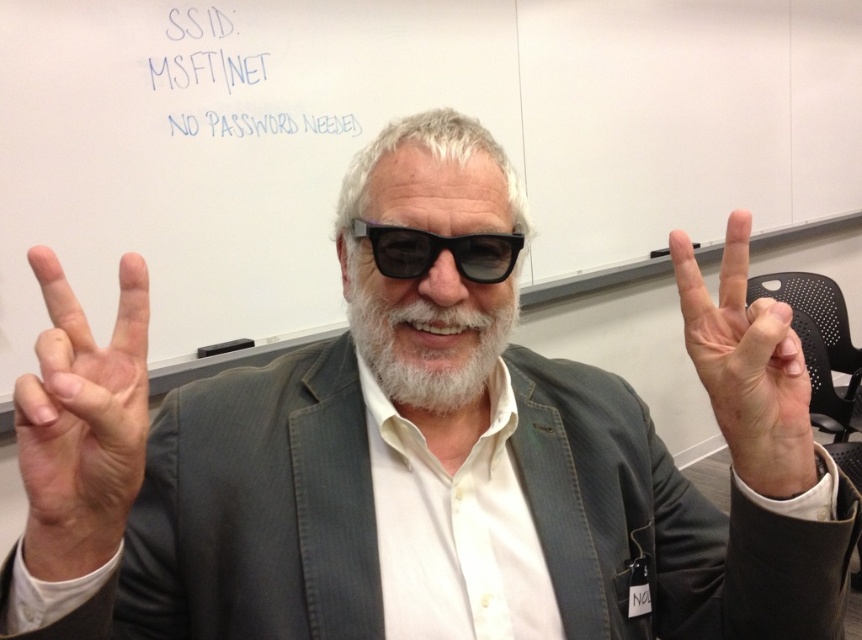
Question: Does whitewool-likebeard at center have a larger size compared to black matte glasses at center?

Choices:
 (A) no
 (B) yes

Answer: (B)

Question: Which object is the closest to the white skin at left?

Choices:
 (A) black matte glasses at center
 (B) blue ink writing at upper left
 (C) whitewool-likebeard at center
 (D) pink flesh at center

Answer: (C)

Question: Estimate the real-world distances between objects in this image. Which object is closer to the white skin at left?

Choices:
 (A) blue ink writing at upper left
 (B) pink flesh at center
 (C) black matte glasses at center

Answer: (C)

Question: Can you confirm if white skin at left is smaller than pink flesh at center?

Choices:
 (A) yes
 (B) no

Answer: (A)

Question: In this image, where is blue ink writing at upper left located relative to whitewool-likebeard at center?

Choices:
 (A) right
 (B) left

Answer: (B)

Question: Which object appears farthest from the camera in this image?

Choices:
 (A) white skin at left
 (B) pink flesh at center

Answer: (B)